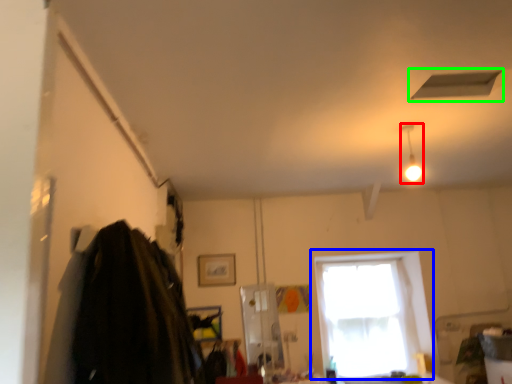
Question: Considering the real-world distances, which object is farthest from light fixture (highlighted by a red box)? window (highlighted by a blue box) or exhaust hood (highlighted by a green box)?

Choices:
 (A) window
 (B) exhaust hood

Answer: (A)